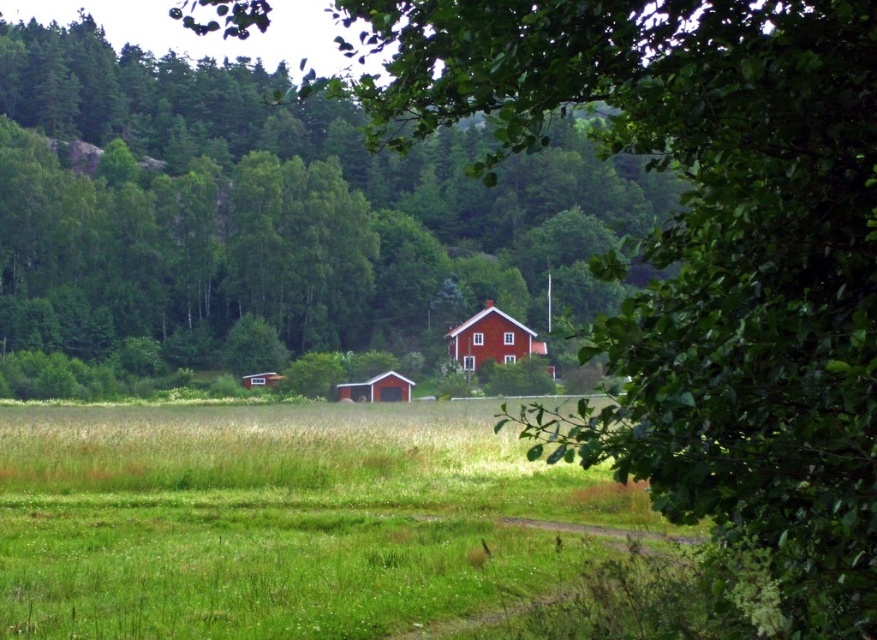
Between point (136, 92) and point (357, 396), which one is positioned behind?

The point (136, 92) is behind.

Based on the photo, is green leafy tree at center bigger than matte red barn at center?

Yes, green leafy tree at center is bigger than matte red barn at center.

Which is behind, point (272, 307) or point (364, 394)?

The point (272, 307) is behind.

The height and width of the screenshot is (640, 877). Identify the location of green leafy tree at center. (305, 138).

Who is higher up, matte red barn at center or wooden barn at center?

wooden barn at center is above.

From the picture: Can you confirm if matte red barn at center is wider than wooden barn at center?

Incorrect, matte red barn at center's width does not surpass wooden barn at center's.

This screenshot has width=877, height=640. Identify the location of matte red barn at center. (376, 388).

Measure the distance between green leafy tree at center and wooden barn at center.

A distance of 30.99 meters exists between green leafy tree at center and wooden barn at center.

Does green leafy tree at center have a larger size compared to wooden barn at center?

Indeed, green leafy tree at center has a larger size compared to wooden barn at center.

Locate an element on the screen. The height and width of the screenshot is (640, 877). green leafy tree at center is located at coordinates tap(305, 138).